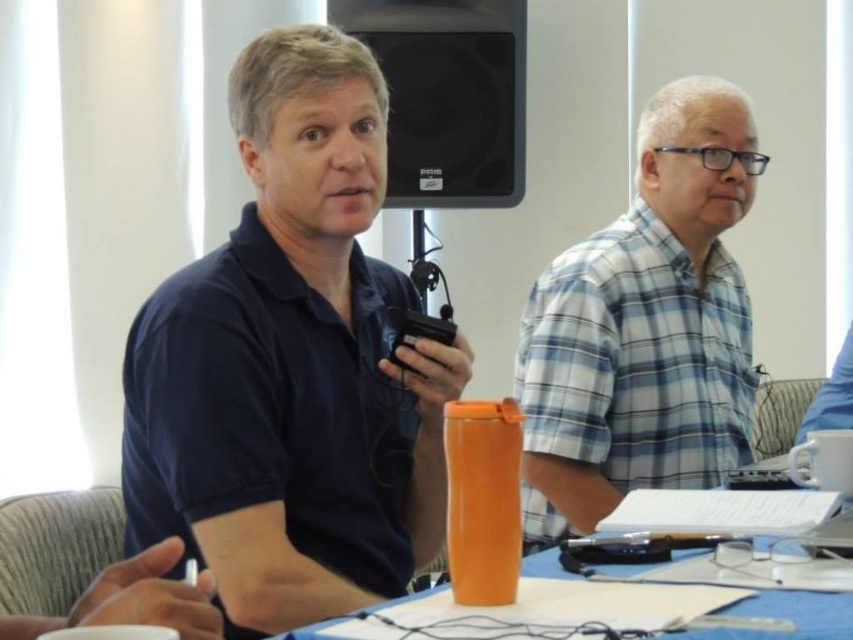
Question: Among these objects, which one is nearest to the camera?

Choices:
 (A) orange plastic cup at center
 (B) dark blue shirt at center
 (C) blue plaid shirt at center

Answer: (A)

Question: Does dark blue shirt at center have a lesser width compared to blue plaid shirt at center?

Choices:
 (A) no
 (B) yes

Answer: (B)

Question: Which of the following is the closest to the observer?

Choices:
 (A) (596, 369)
 (B) (128, 550)

Answer: (B)

Question: Does dark blue shirt at center appear over blue plaid shirt at center?

Choices:
 (A) no
 (B) yes

Answer: (B)

Question: Does dark blue shirt at center have a lesser width compared to orange plastic cup at center?

Choices:
 (A) yes
 (B) no

Answer: (A)

Question: Estimate the real-world distances between objects in this image. Which object is closer to the blue plaid shirt at center?

Choices:
 (A) orange plastic cup at center
 (B) dark blue shirt at center

Answer: (B)